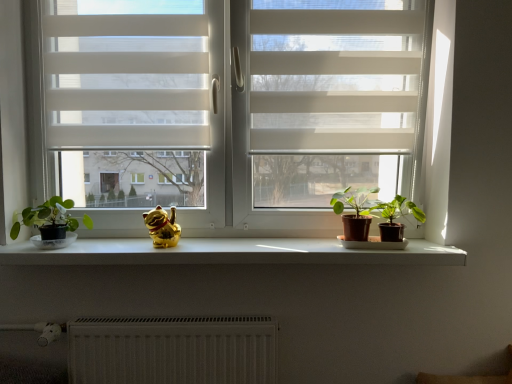
Question: Can you confirm if gold shiny cat at center is shorter than green matte houseplant at right, acting as the 1th houseplant starting from the right?

Choices:
 (A) yes
 (B) no

Answer: (A)

Question: Could you tell me if gold shiny cat at center is turned towards green matte houseplant at right, the third houseplant when ordered from left to right?

Choices:
 (A) yes
 (B) no

Answer: (B)

Question: Considering the relative sizes of gold shiny cat at center and green matte houseplant at right, acting as the 1th houseplant starting from the right, in the image provided, is gold shiny cat at center taller than green matte houseplant at right, acting as the 1th houseplant starting from the right,?

Choices:
 (A) yes
 (B) no

Answer: (B)

Question: Considering the relative positions of gold shiny cat at center and green matte houseplant at right, the third houseplant when ordered from left to right, in the image provided, is gold shiny cat at center to the left of green matte houseplant at right, the third houseplant when ordered from left to right, from the viewer's perspective?

Choices:
 (A) no
 (B) yes

Answer: (B)

Question: Can you see gold shiny cat at center touching green matte houseplant at right, acting as the 1th houseplant starting from the right?

Choices:
 (A) yes
 (B) no

Answer: (B)

Question: From the image's perspective, relative to white matte screen door at upper center, is white sheer blinds at upper left above or below?

Choices:
 (A) below
 (B) above

Answer: (B)

Question: From a real-world perspective, is white sheer blinds at upper left above or below white matte screen door at upper center?

Choices:
 (A) below
 (B) above

Answer: (B)

Question: Considering the positions of white sheer blinds at upper left and white matte screen door at upper center in the image, is white sheer blinds at upper left taller or shorter than white matte screen door at upper center?

Choices:
 (A) short
 (B) tall

Answer: (A)

Question: Considering the positions of point (120, 57) and point (348, 14), is point (120, 57) closer or farther from the camera than point (348, 14)?

Choices:
 (A) farther
 (B) closer

Answer: (A)

Question: Does point (156, 246) appear closer or farther from the camera than point (257, 246)?

Choices:
 (A) closer
 (B) farther

Answer: (A)

Question: Which is correct: gold shiny cat at center is inside white smooth window sill at center, or outside of it?

Choices:
 (A) outside
 (B) inside

Answer: (A)

Question: From a real-world perspective, is gold shiny cat at center positioned above or below white smooth window sill at center?

Choices:
 (A) below
 (B) above

Answer: (B)

Question: Would you say gold shiny cat at center is to the left or to the right of white smooth window sill at center in the picture?

Choices:
 (A) right
 (B) left

Answer: (B)

Question: Is white matte window at center bigger or smaller than green matte plant at center, placed as the 2th houseplant when sorted from right to left?

Choices:
 (A) big
 (B) small

Answer: (A)

Question: From a real-world perspective, is white matte window at center above or below green matte plant at center, placed as the 2th houseplant when sorted from right to left?

Choices:
 (A) below
 (B) above

Answer: (B)